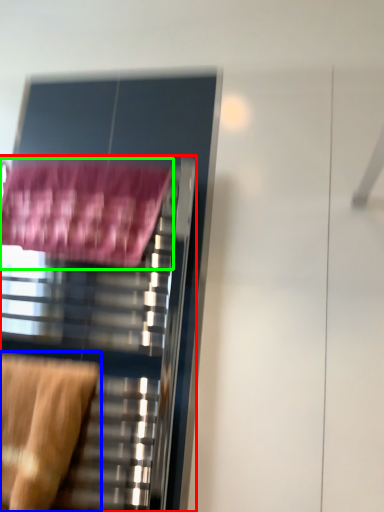
Question: Which is nearer to the furniture (highlighted by a red box)? swivel chair (highlighted by a blue box) or bath towel (highlighted by a green box).

Choices:
 (A) swivel chair
 (B) bath towel

Answer: (A)